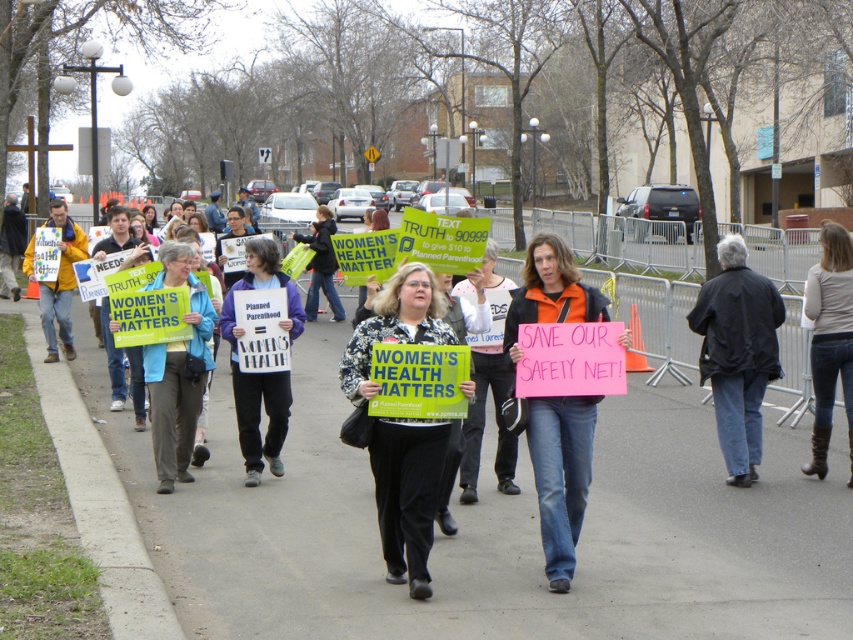
Question: Which point is closer to the camera?

Choices:
 (A) green fabric sign at left
 (B) matte black jacket at center
 (C) matte purple shirt at center
 (D) black textured coat at center

Answer: (D)

Question: Observing the image, what is the correct spatial positioning of gray concrete pavement at center in reference to pink fabric sign at center?

Choices:
 (A) above
 (B) below

Answer: (B)

Question: Which is farther from the gray concrete pavement at center?

Choices:
 (A) pink fabric sign at center
 (B) green fabric sign at left
 (C) matte black jacket at center
 (D) denim jeans at lower right

Answer: (D)

Question: Which is farther from the gray concrete pavement at center?

Choices:
 (A) pink fabric sign at center
 (B) green fabric sign at left

Answer: (A)

Question: Where is pink fabric sign at center located in relation to matte black jacket at center in the image?

Choices:
 (A) left
 (B) right

Answer: (B)

Question: Does matte purple shirt at center appear under matte black jacket at center?

Choices:
 (A) no
 (B) yes

Answer: (A)